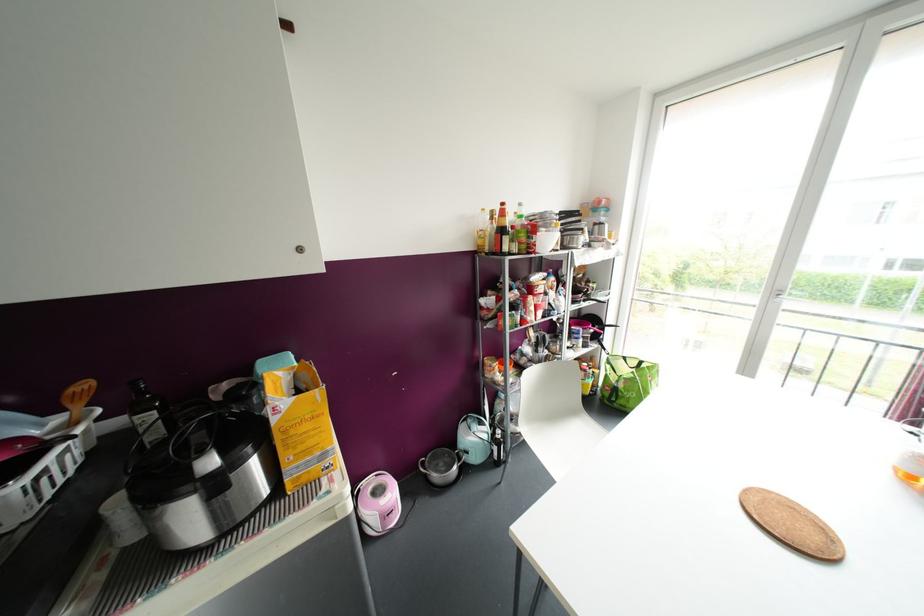
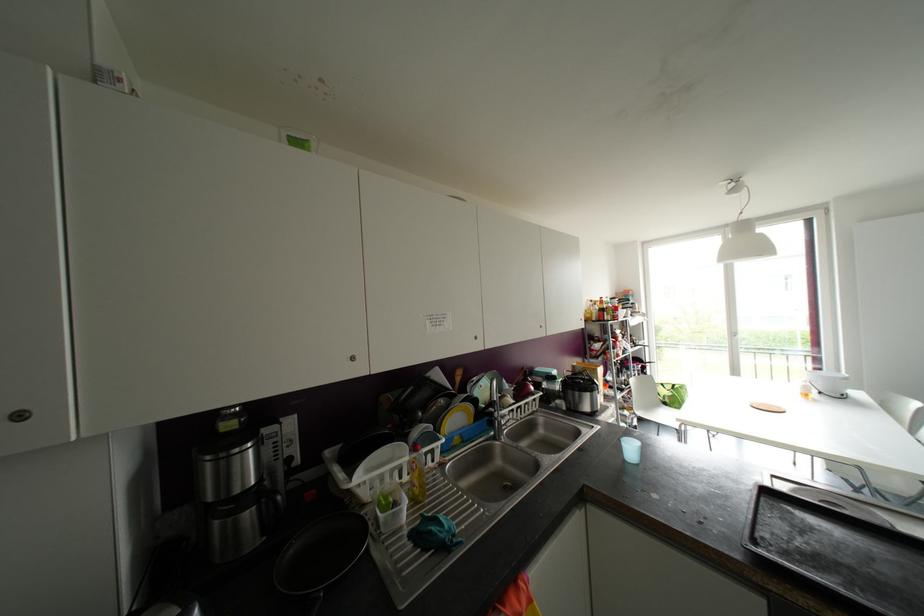
Question: I am providing you with two images of the same scene from different viewpoints. Which of the following objects are not visible in image2?

Choices:
 (A) pink rice cooker
 (B) yellow soap bottle
 (C) chair sitting surface
 (D) brown cardboard box

Answer: (A)